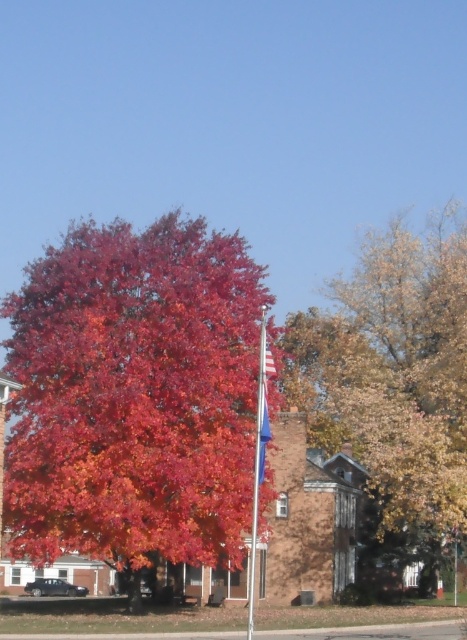
Consider the image. You are standing in the autumn scene and want to place a small decorative flag exactly at the point marked by the coordinates point (134,396). What will the flag be placed on?

The point (134,396) is on shiny red leaves at center, so the flag will be placed on the shiny red leaves at center.